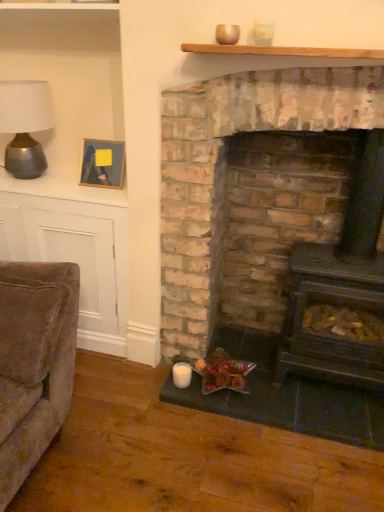
Question: Is dark gray cast iron wood burning stove at center placed right next to brick fireplace at center?

Choices:
 (A) no
 (B) yes

Answer: (A)

Question: From a real-world perspective, is dark gray cast iron wood burning stove at center under brick fireplace at center?

Choices:
 (A) yes
 (B) no

Answer: (A)

Question: Can you confirm if dark gray cast iron wood burning stove at center is smaller than brick fireplace at center?

Choices:
 (A) no
 (B) yes

Answer: (B)

Question: Is the position of dark gray cast iron wood burning stove at center more distant than that of brick fireplace at center?

Choices:
 (A) no
 (B) yes

Answer: (B)

Question: From the image's perspective, is dark gray cast iron wood burning stove at center located beneath brick fireplace at center?

Choices:
 (A) yes
 (B) no

Answer: (A)

Question: Considering the positions of brick fireplace at center and wooden picture frame at upper left in the image, is brick fireplace at center wider or thinner than wooden picture frame at upper left?

Choices:
 (A) wide
 (B) thin

Answer: (A)

Question: Considering the positions of point (261, 159) and point (92, 180), is point (261, 159) closer or farther from the camera than point (92, 180)?

Choices:
 (A) closer
 (B) farther

Answer: (A)

Question: From a real-world perspective, is brick fireplace at center physically located above or below wooden picture frame at upper left?

Choices:
 (A) below
 (B) above

Answer: (A)

Question: Is brick fireplace at center inside the boundaries of wooden picture frame at upper left, or outside?

Choices:
 (A) outside
 (B) inside

Answer: (A)

Question: From a real-world perspective, is matte silver table lamp at left above or below shiny brown nuts at lower center?

Choices:
 (A) below
 (B) above

Answer: (B)

Question: Is matte silver table lamp at left taller or shorter than shiny brown nuts at lower center?

Choices:
 (A) tall
 (B) short

Answer: (A)

Question: Is matte silver table lamp at left to the left or to the right of shiny brown nuts at lower center in the image?

Choices:
 (A) left
 (B) right

Answer: (A)

Question: Does point (18, 118) appear closer or farther from the camera than point (225, 351)?

Choices:
 (A) farther
 (B) closer

Answer: (B)

Question: From the image's perspective, is matte silver table lamp at left located above or below brick fireplace at center?

Choices:
 (A) below
 (B) above

Answer: (B)

Question: Is matte silver table lamp at left wider or thinner than brick fireplace at center?

Choices:
 (A) thin
 (B) wide

Answer: (A)